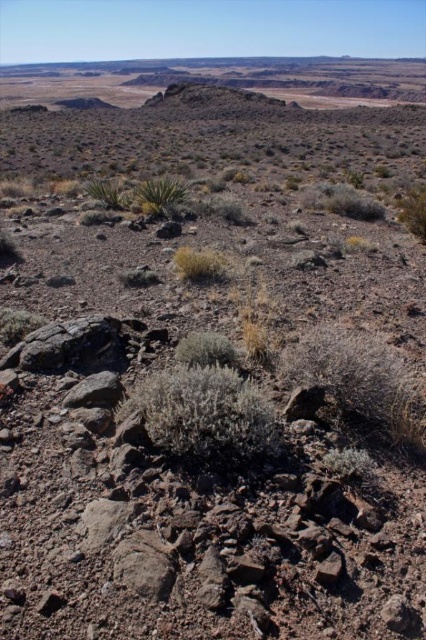
You are a hiker trying to navigate through the desert. You see dry grass at center and a green fuzzy bush at right. Which of these two objects is taller?

The green fuzzy bush at right is taller than the dry grass at center.

You are a desert explorer who needs to find shade. You see a green fuzzy bush at center and dry grass at center. Which one is lower to the ground and could potentially provide shade?

The green fuzzy bush at center is located below dry grass at center, so it is lower to the ground and could potentially provide shade.